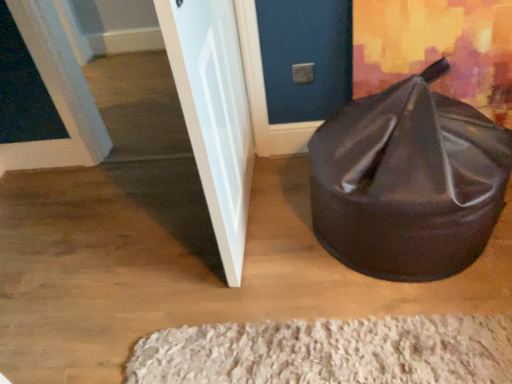
Question: Does white glossy door at left, the second door from the left, have a smaller size compared to white shaggy rug at lower center?

Choices:
 (A) no
 (B) yes

Answer: (A)

Question: From a real-world perspective, is white glossy door at left, the second door from the left, under white shaggy rug at lower center?

Choices:
 (A) yes
 (B) no

Answer: (B)

Question: Does white glossy door at left, the second door from the left, lie in front of white shaggy rug at lower center?

Choices:
 (A) no
 (B) yes

Answer: (B)

Question: Considering the relative sizes of white glossy door at left, the second door from the left, and white shaggy rug at lower center in the image provided, is white glossy door at left, the second door from the left, bigger than white shaggy rug at lower center?

Choices:
 (A) no
 (B) yes

Answer: (B)

Question: Is white glossy door at left, the second door from the left, completely or partially outside of white shaggy rug at lower center?

Choices:
 (A) yes
 (B) no

Answer: (A)

Question: Looking at the image, does black leather bean bag at lower right seem bigger or smaller compared to white shaggy rug at lower center?

Choices:
 (A) small
 (B) big

Answer: (B)

Question: Is black leather bean bag at lower right in front of or behind white shaggy rug at lower center in the image?

Choices:
 (A) behind
 (B) front

Answer: (B)

Question: Is point 438,117 positioned closer to the camera than point 414,357?

Choices:
 (A) farther
 (B) closer

Answer: (A)

Question: Which is correct: black leather bean bag at lower right is inside white shaggy rug at lower center, or outside of it?

Choices:
 (A) outside
 (B) inside

Answer: (A)

Question: Choose the correct answer: Is white glossy door at left, which is the 1th door in right-to-left order, inside white shaggy rug at lower center or outside it?

Choices:
 (A) outside
 (B) inside

Answer: (A)

Question: Considering the relative positions of white glossy door at left, which is the 1th door in right-to-left order, and white shaggy rug at lower center in the image provided, is white glossy door at left, which is the 1th door in right-to-left order, to the left or to the right of white shaggy rug at lower center?

Choices:
 (A) left
 (B) right

Answer: (A)

Question: Is white glossy door at left, the second door from the left, in front of or behind white shaggy rug at lower center in the image?

Choices:
 (A) behind
 (B) front

Answer: (B)

Question: From a real-world perspective, is white glossy door at left, which is the 1th door in right-to-left order, physically located above or below white shaggy rug at lower center?

Choices:
 (A) below
 (B) above

Answer: (B)

Question: Choose the correct answer: Is white painted wood door at upper left, which ranks as the first door in left-to-right order, inside black leather bean bag at lower right or outside it?

Choices:
 (A) outside
 (B) inside

Answer: (A)

Question: From the image's perspective, is white painted wood door at upper left, which ranks as the first door in left-to-right order, located above or below black leather bean bag at lower right?

Choices:
 (A) above
 (B) below

Answer: (A)